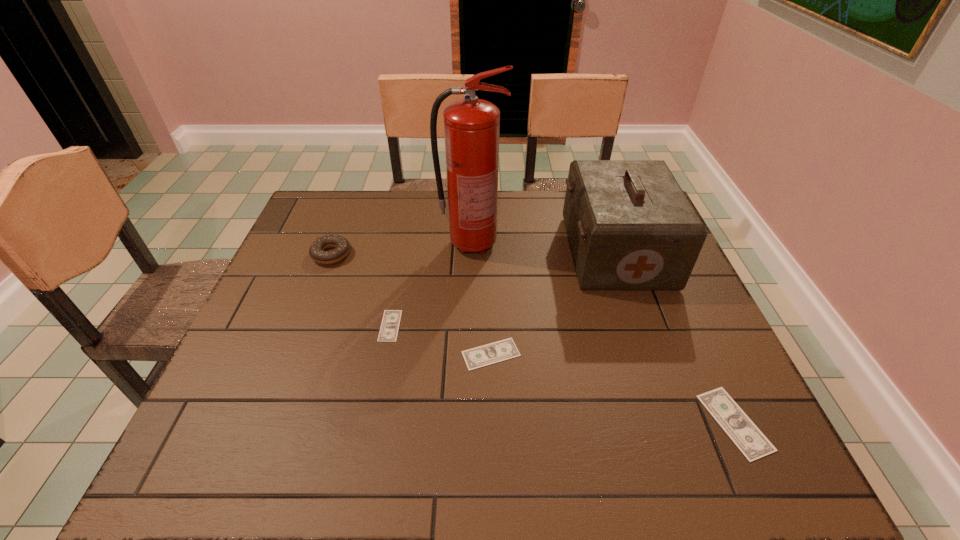
Where is `free location located on the right of the fifth object from right to left`? free location located on the right of the fifth object from right to left is located at coordinates (552, 326).

At what (x,y) coordinates should I click in order to perform the action: click on blank area located on the back of the fifth tallest object. Please return your answer as a coordinate pair (x, y). Looking at the image, I should click on (490, 313).

Find the location of a particular element. free space located 0.300m on the back of the tallest money is located at coordinates click(x=674, y=289).

Where is `vacant space located 0.290m on the handle side the fire extinguisher`? The image size is (960, 540). vacant space located 0.290m on the handle side the fire extinguisher is located at coordinates (603, 244).

Where is `vacant space located on the left of the first-aid kit`? vacant space located on the left of the first-aid kit is located at coordinates (437, 252).

Locate an element on the screen. The image size is (960, 540). free space located on the back of the third tallest object is located at coordinates pyautogui.click(x=351, y=203).

Image resolution: width=960 pixels, height=540 pixels. What are the coordinates of `fire extinguisher situated at the far edge` in the screenshot? It's located at (471, 126).

Identify the location of the first-aid kit located at the far edge. The height and width of the screenshot is (540, 960). (630, 226).

This screenshot has width=960, height=540. Identify the location of object that is at the near edge. (752, 443).

At what (x,y) coordinates should I click in order to perform the action: click on object positioned at the left edge. Please return your answer as a coordinate pair (x, y). Looking at the image, I should click on (317, 249).